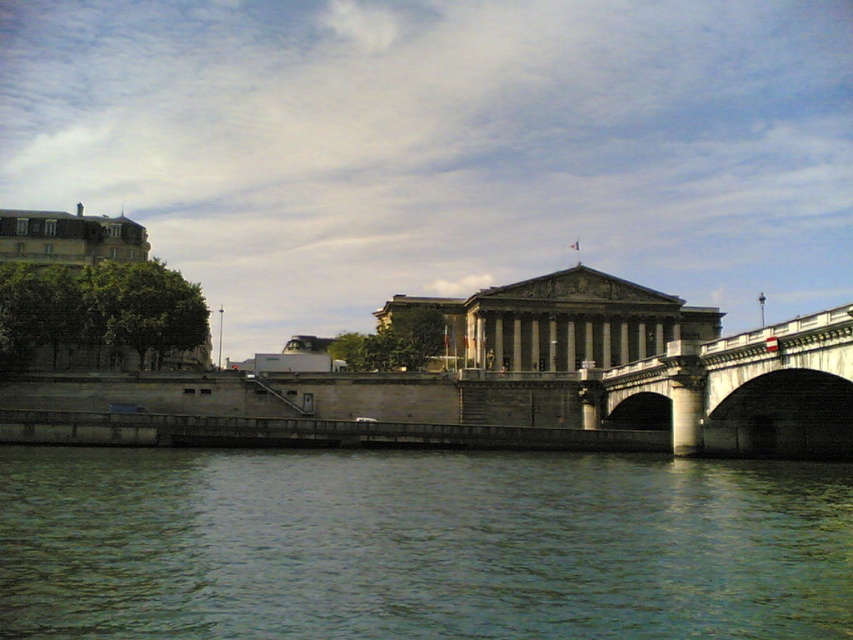
Is the position of greenish water at lower center more distant than that of stone bridge at center?

No, greenish water at lower center is in front of stone bridge at center.

Does greenish water at lower center appear on the left side of stone bridge at center?

Indeed, greenish water at lower center is positioned on the left side of stone bridge at center.

Consider the image. Measure the distance between greenish water at lower center and camera.

They are 111.87 feet apart.

The image size is (853, 640). Find the location of `greenish water at lower center`. greenish water at lower center is located at coordinates (419, 545).